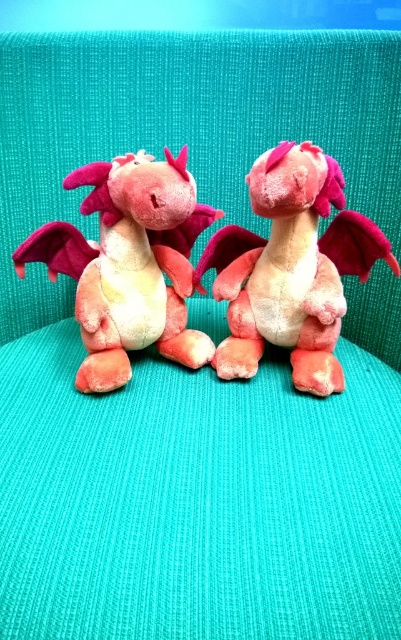
Is velvet pink plush dragon at center to the left of velvet pink dragon at left from the viewer's perspective?

In fact, velvet pink plush dragon at center is to the right of velvet pink dragon at left.

The width and height of the screenshot is (401, 640). Describe the element at coordinates (291, 268) in the screenshot. I see `velvet pink plush dragon at center` at that location.

This screenshot has width=401, height=640. I want to click on velvet pink plush dragon at center, so click(x=291, y=268).